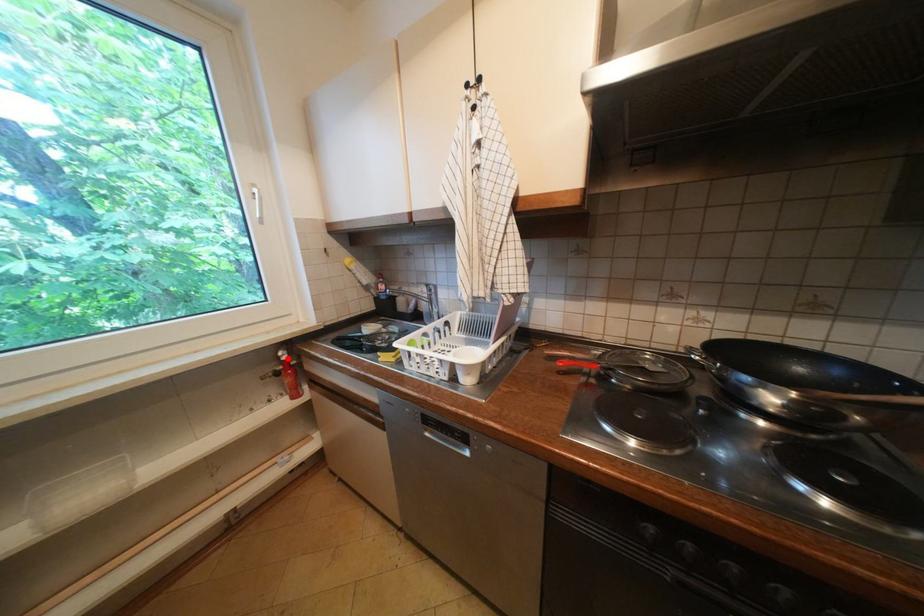
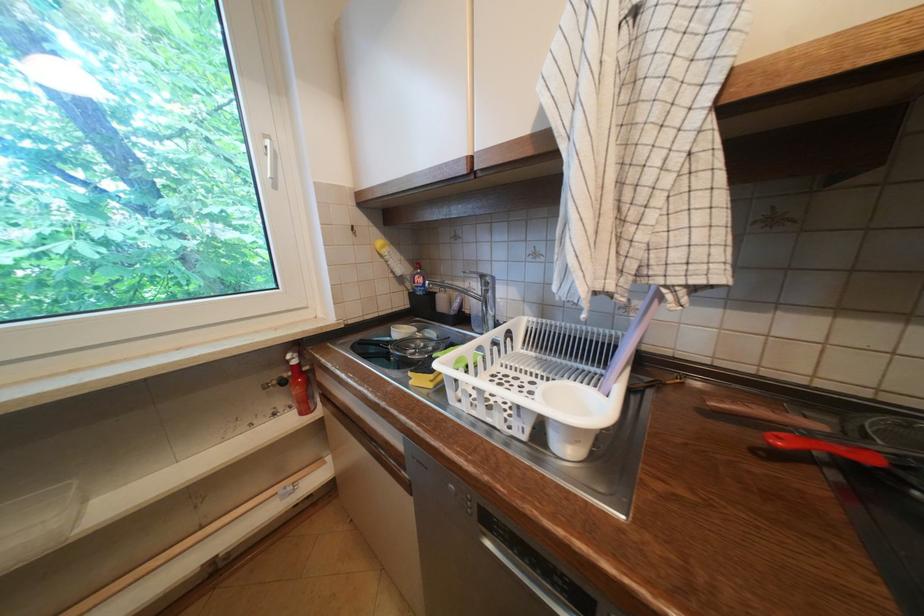
In the second image, find the point that corresponds to the highlighted location in the first image.

(296, 362)